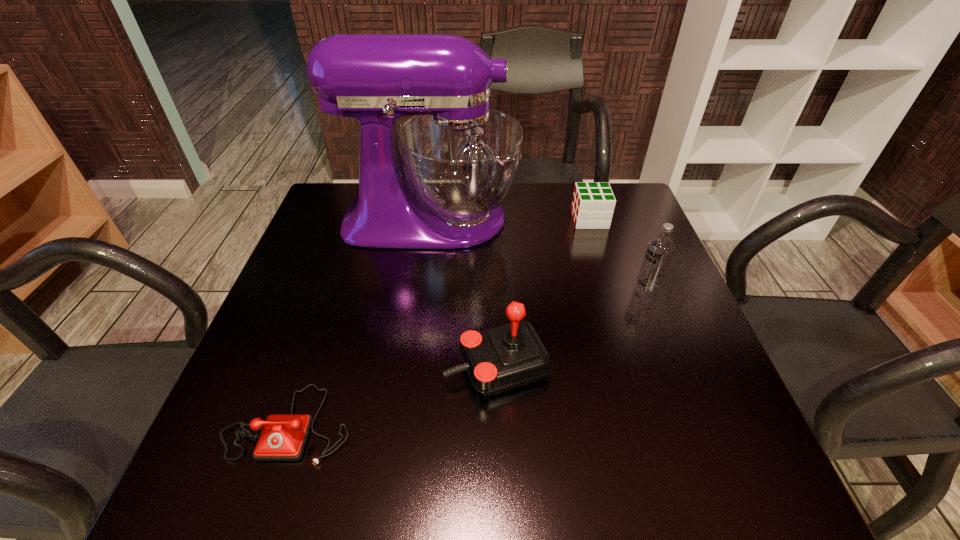
The height and width of the screenshot is (540, 960). Identify the location of free spot located on the front label of the rightmost object. (523, 285).

Where is `free location located 0.250m on the back of the joystick`? This screenshot has height=540, width=960. free location located 0.250m on the back of the joystick is located at coordinates (493, 256).

At what (x,y) coordinates should I click in order to perform the action: click on vacant area situated 0.050m on the red face of the fourth object from left to right. Please return your answer as a coordinate pair (x, y). Image resolution: width=960 pixels, height=540 pixels. Looking at the image, I should click on (555, 219).

Image resolution: width=960 pixels, height=540 pixels. In order to click on vacant space located on the red face of the fourth object from left to right in this screenshot , I will do `click(467, 219)`.

Identify the location of vacant space located on the red face of the fourth object from left to right. pos(511,219).

Where is `mixer that is at the far edge`? This screenshot has height=540, width=960. mixer that is at the far edge is located at coordinates (460, 159).

What are the coordinates of `cube that is at the far edge` in the screenshot? It's located at (593, 204).

You are a GUI agent. You are given a task and a screenshot of the screen. Output one action in this format:
    pyautogui.click(x=<x>, y=<y>)
    Task: Click on the object located at the near edge
    
    Given the screenshot: What is the action you would take?
    pyautogui.click(x=283, y=438)

Locate an element on the screen. mixer present at the left edge is located at coordinates (460, 159).

Where is `telephone that is positioned at the left edge`? The image size is (960, 540). telephone that is positioned at the left edge is located at coordinates (283, 438).